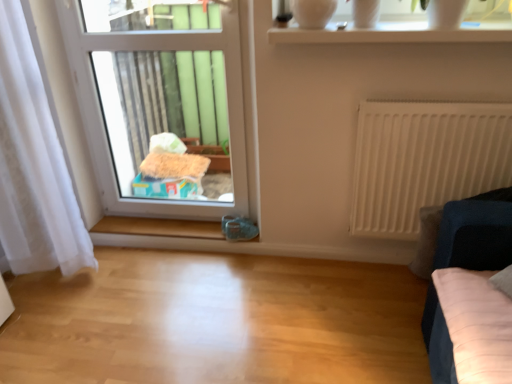
Question: From a real-world perspective, is white matte radiator at right on top of velvet dark blue sofa at right?

Choices:
 (A) no
 (B) yes

Answer: (B)

Question: Is white matte radiator at right not within velvet dark blue sofa at right?

Choices:
 (A) no
 (B) yes

Answer: (B)

Question: Can you confirm if white matte radiator at right is smaller than velvet dark blue sofa at right?

Choices:
 (A) yes
 (B) no

Answer: (A)

Question: Is white matte radiator at right not close to velvet dark blue sofa at right?

Choices:
 (A) no
 (B) yes

Answer: (A)

Question: Considering the relative positions of white matte radiator at right and velvet dark blue sofa at right in the image provided, is white matte radiator at right to the left of velvet dark blue sofa at right from the viewer's perspective?

Choices:
 (A) yes
 (B) no

Answer: (A)

Question: From a real-world perspective, relative to velvet dark blue sofa at right, is white sheer curtain at left vertically above or below?

Choices:
 (A) below
 (B) above

Answer: (B)

Question: In terms of height, does white sheer curtain at left look taller or shorter compared to velvet dark blue sofa at right?

Choices:
 (A) tall
 (B) short

Answer: (A)

Question: Considering the relative positions of white sheer curtain at left and velvet dark blue sofa at right in the image provided, is white sheer curtain at left to the left or to the right of velvet dark blue sofa at right?

Choices:
 (A) left
 (B) right

Answer: (A)

Question: Considering their positions, is white sheer curtain at left located in front of or behind velvet dark blue sofa at right?

Choices:
 (A) behind
 (B) front

Answer: (A)

Question: From the image's perspective, is white matte radiator at right located above or below transparent glass vase at upper center?

Choices:
 (A) above
 (B) below

Answer: (B)

Question: Is white matte radiator at right taller or shorter than transparent glass vase at upper center?

Choices:
 (A) tall
 (B) short

Answer: (A)

Question: From a real-world perspective, is white matte radiator at right positioned above or below transparent glass vase at upper center?

Choices:
 (A) below
 (B) above

Answer: (A)

Question: Would you say white matte radiator at right is inside or outside transparent glass vase at upper center?

Choices:
 (A) inside
 (B) outside

Answer: (B)

Question: From a real-world perspective, is transparent plastic window at center, arranged as the 2th window when viewed from the right, positioned above or below transparent glass vase at upper center?

Choices:
 (A) below
 (B) above

Answer: (A)

Question: Is transparent plastic window at center, marked as the 1th window in a left-to-right arrangement, to the left or to the right of transparent glass vase at upper center in the image?

Choices:
 (A) right
 (B) left

Answer: (B)